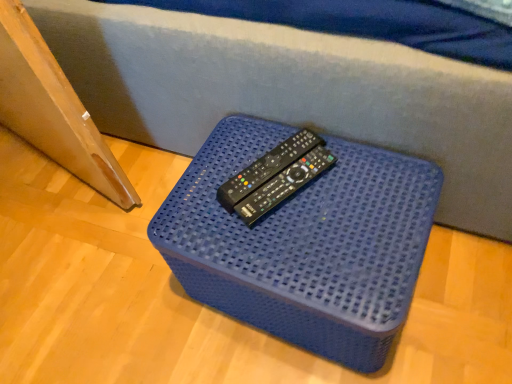
Question: From a real-world perspective, relative to black plastic remote at center, is blue plastic container at center vertically above or below?

Choices:
 (A) above
 (B) below

Answer: (B)

Question: Relative to black plastic remote at center, is blue plastic container at center in front or behind?

Choices:
 (A) front
 (B) behind

Answer: (A)

Question: In terms of size, does blue plastic container at center appear bigger or smaller than black plastic remote at center?

Choices:
 (A) big
 (B) small

Answer: (A)

Question: Is black plastic remote at center taller or shorter than blue plastic container at center?

Choices:
 (A) tall
 (B) short

Answer: (B)

Question: From a real-world perspective, is black plastic remote at center positioned above or below blue plastic container at center?

Choices:
 (A) above
 (B) below

Answer: (A)

Question: From the image's perspective, is black plastic remote at center above or below blue plastic container at center?

Choices:
 (A) below
 (B) above

Answer: (B)

Question: Is point tap(271, 150) positioned closer to the camera than point tap(334, 352)?

Choices:
 (A) farther
 (B) closer

Answer: (A)